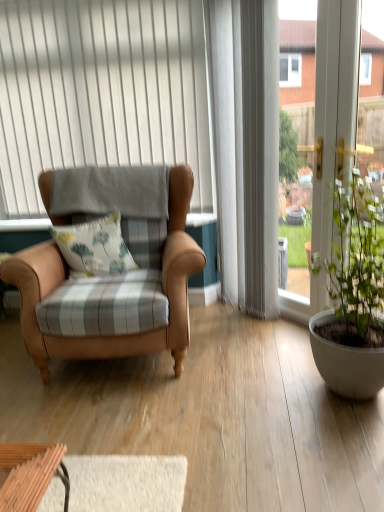
Question: Is white textured curtain at upper center situated inside white plastic window frame at right or outside?

Choices:
 (A) outside
 (B) inside

Answer: (A)

Question: Considering the positions of white textured curtain at upper center and white plastic window frame at right in the image, is white textured curtain at upper center wider or thinner than white plastic window frame at right?

Choices:
 (A) thin
 (B) wide

Answer: (A)

Question: Which object is the farthest from the matte white pot at right?

Choices:
 (A) leather armchair at left
 (B) floral fabric cushion at center
 (C) white textured curtain at upper center
 (D) white plastic window frame at right

Answer: (C)

Question: Based on their relative distances, which object is nearer to the white textured curtain at upper center?

Choices:
 (A) white plastic window frame at right
 (B) floral fabric cushion at center
 (C) leather armchair at left
 (D) matte white pot at right

Answer: (C)